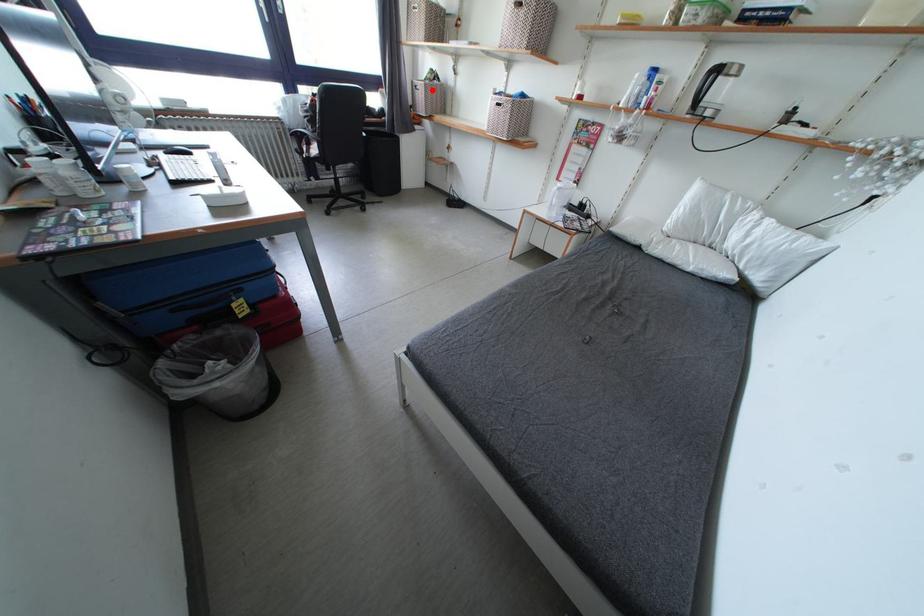
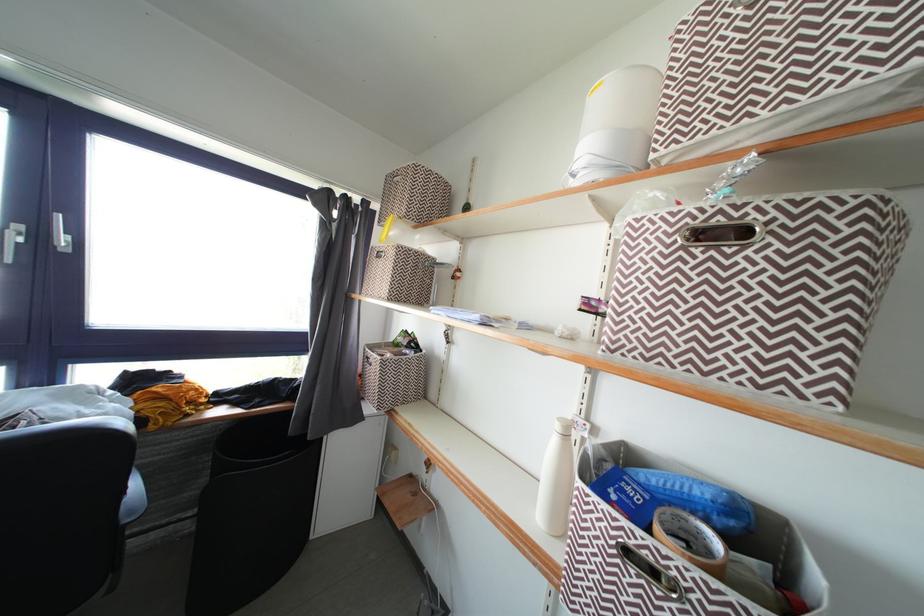
Question: I am providing you with two images of the same scene from different viewpoints. Given a red point in image1, look at the same physical point in image2. Is it:

Choices:
 (A) Closer to the viewpoint
 (B) Farther from the viewpoint

Answer: (B)